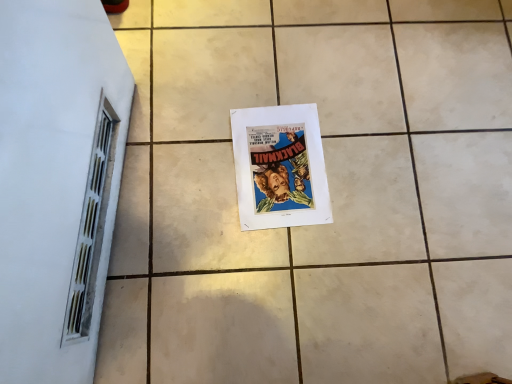
This screenshot has width=512, height=384. Identify the location of vacant space situated above vibrant paper poster at center (from a real-world perspective). (280, 165).